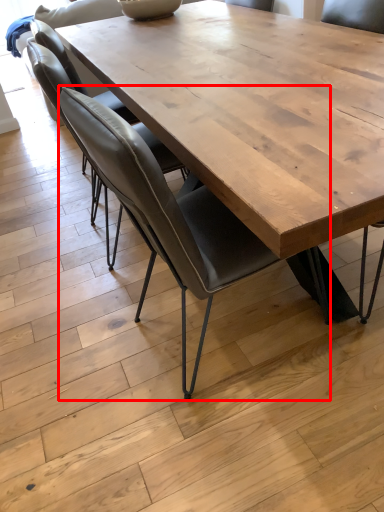
Question: From the image's perspective, what is the correct spatial positioning of chair (annotated by the red box) in reference to chair?

Choices:
 (A) above
 (B) below

Answer: (B)